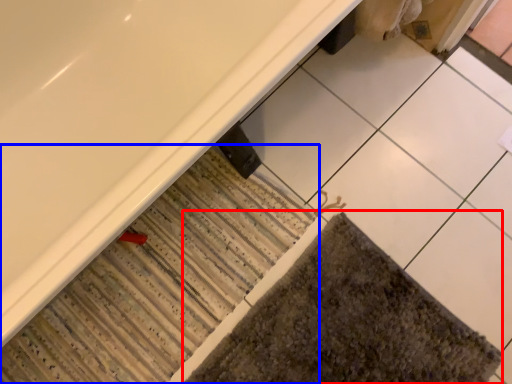
Question: Among these objects, which one is nearest to the camera, bath mat (highlighted by a red box) or bath mat (highlighted by a blue box)?

Choices:
 (A) bath mat
 (B) bath mat

Answer: (A)